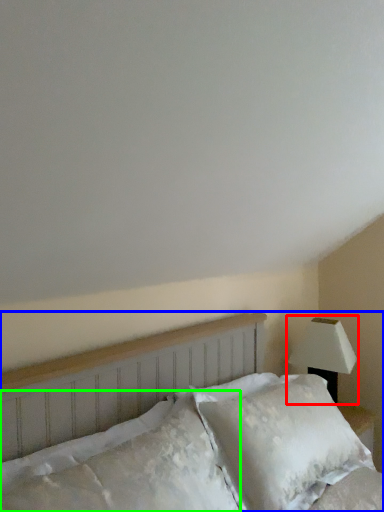
Question: Considering the real-world distances, which object is closest to lamp (highlighted by a red box)? bed (highlighted by a blue box) or pillow (highlighted by a green box).

Choices:
 (A) bed
 (B) pillow

Answer: (A)